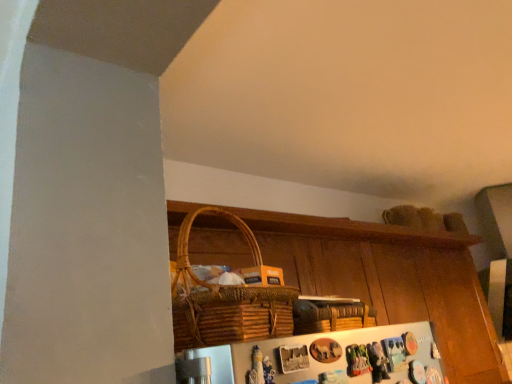
This screenshot has height=384, width=512. Identify the location of woven wood cabinet at upper center. (391, 278).

What do you see at coordinates (391, 278) in the screenshot? The height and width of the screenshot is (384, 512). I see `woven wood cabinet at upper center` at bounding box center [391, 278].

I want to click on woven wood cabinet at upper center, so click(391, 278).